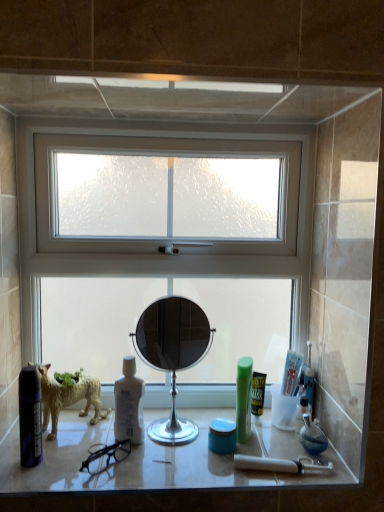
Locate an element on the screen. Image resolution: width=384 pixels, height=512 pixels. vacant area that is situated to the right of white glossy mouthwash at center, the 1th mouthwash viewed from the left is located at coordinates (192, 446).